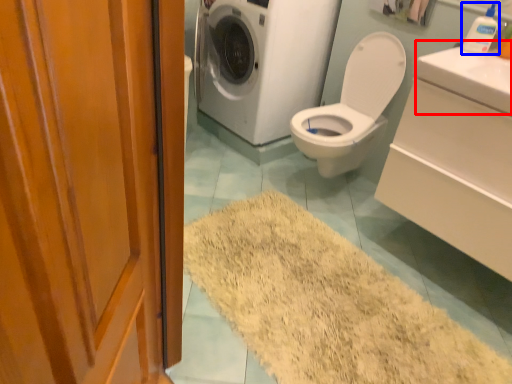
Question: Among these objects, which one is farthest to the camera, counter top (highlighted by a red box) or toiletry (highlighted by a blue box)?

Choices:
 (A) counter top
 (B) toiletry

Answer: (B)